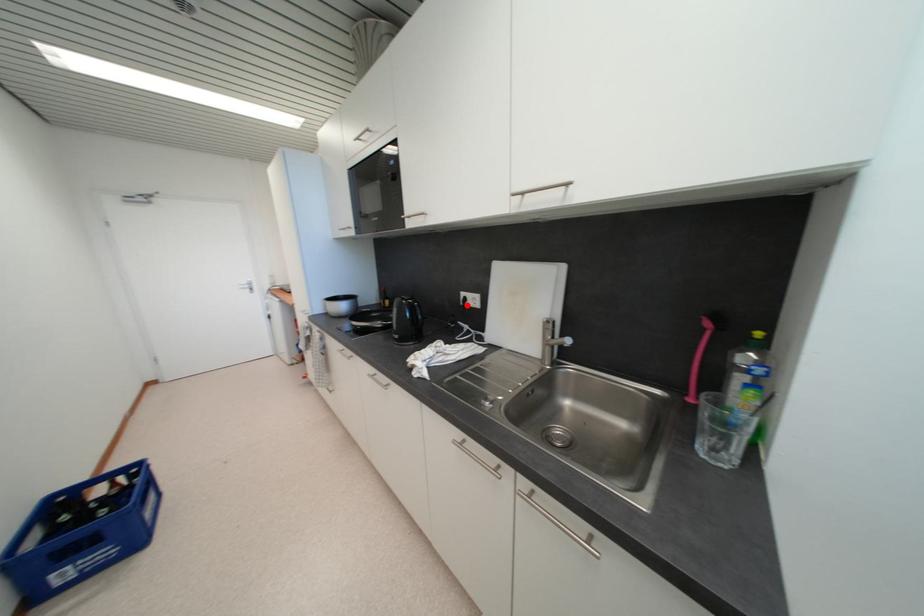
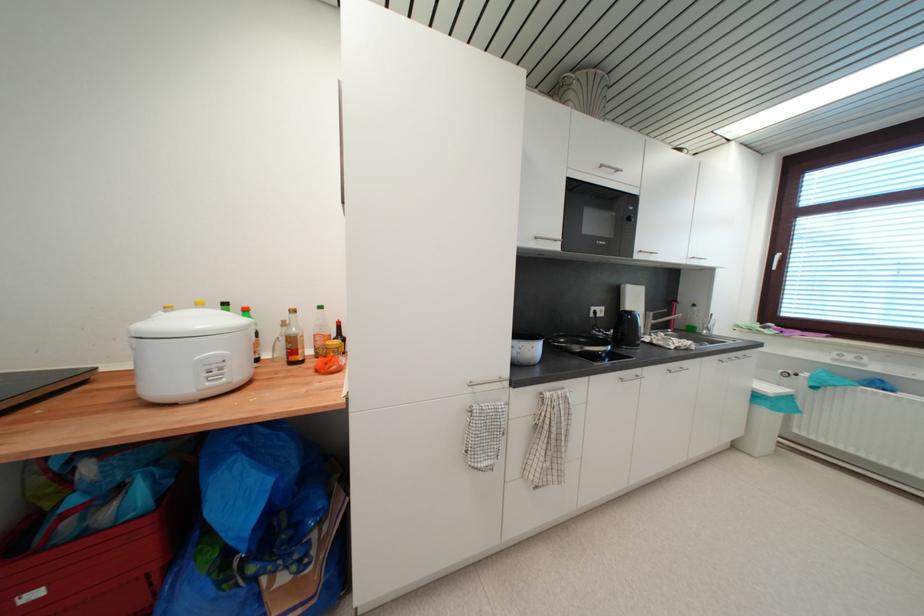
Where in the second image is the point corresponding to the highlighted location from the first image?

(597, 317)